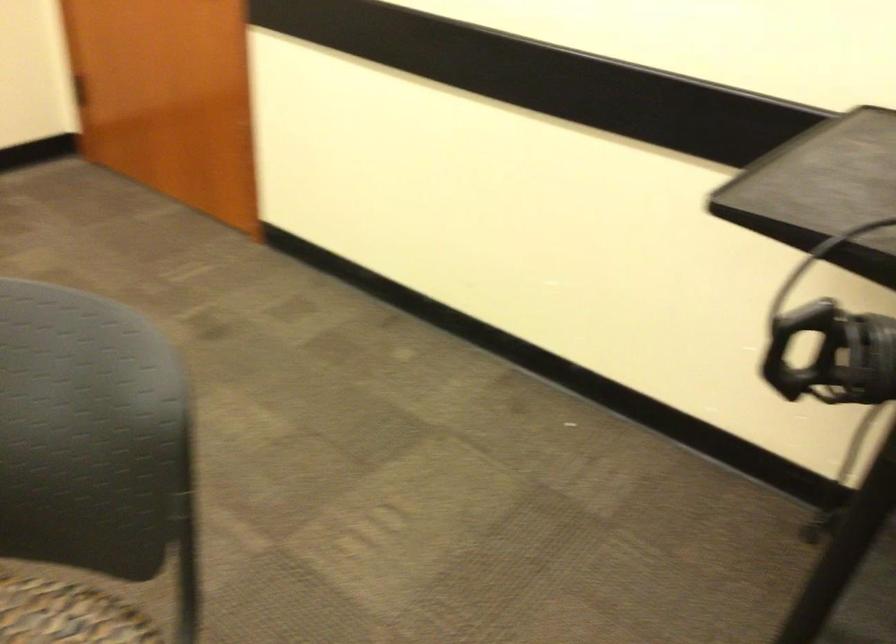
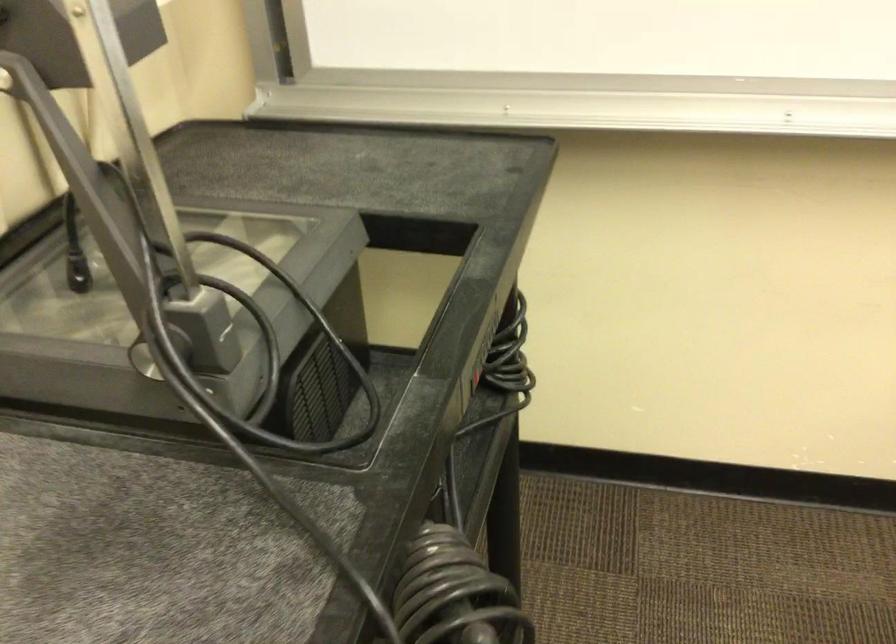
First-person continuous shooting, in which direction is the camera rotating?

The camera's rotation is toward right-down.